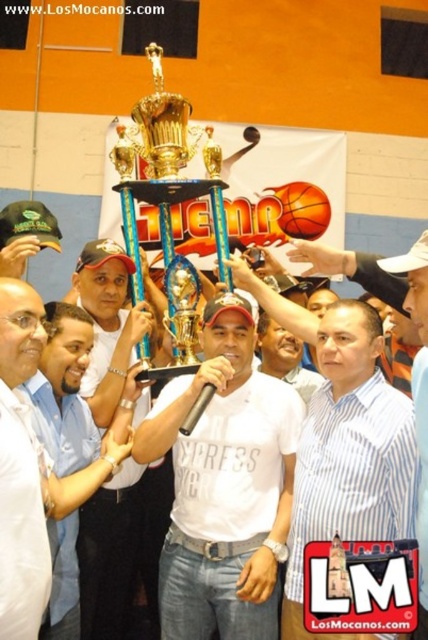
Question: Which of the following is the closest to the observer?

Choices:
 (A) metallic trophy at center
 (B) white matte t-shirt at center
 (C) white shirt at center
 (D) matte black cap at center

Answer: (C)

Question: Does matte black cap at center appear over gold shiny trophy at center?

Choices:
 (A) yes
 (B) no

Answer: (B)

Question: Observing the image, what is the correct spatial positioning of white striped shirt at center in reference to gold shiny trophy at center?

Choices:
 (A) above
 (B) below

Answer: (B)

Question: Is matte black cap at center wider than white shirt at center?

Choices:
 (A) yes
 (B) no

Answer: (B)

Question: Which point is closer to the camera taking this photo?

Choices:
 (A) (389, 358)
 (B) (18, 621)
 (C) (181, 150)

Answer: (B)

Question: Which of the following is the closest to the observer?

Choices:
 (A) white shirt at center
 (B) striped shirt at center
 (C) gold shiny trophy at center
 (D) matte black cap at center

Answer: (A)